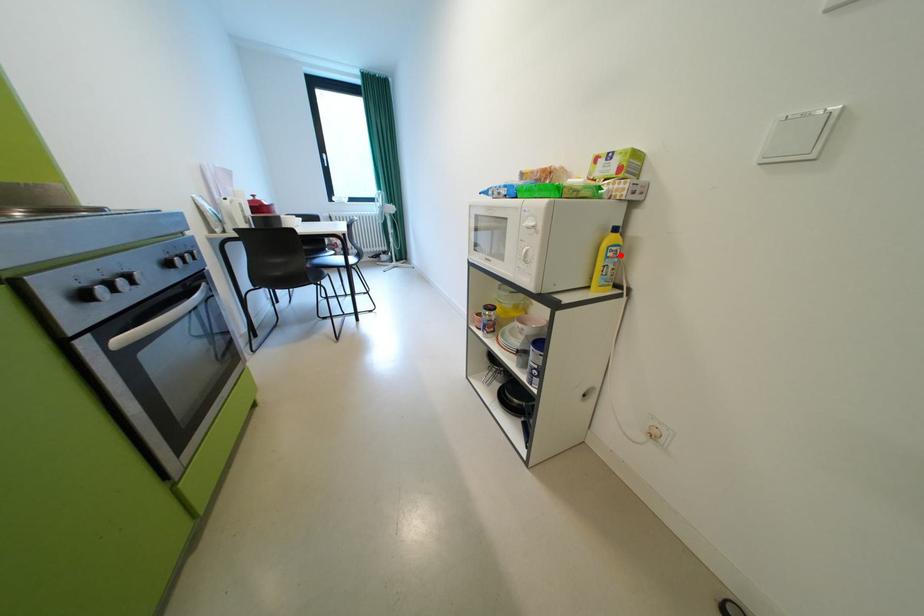
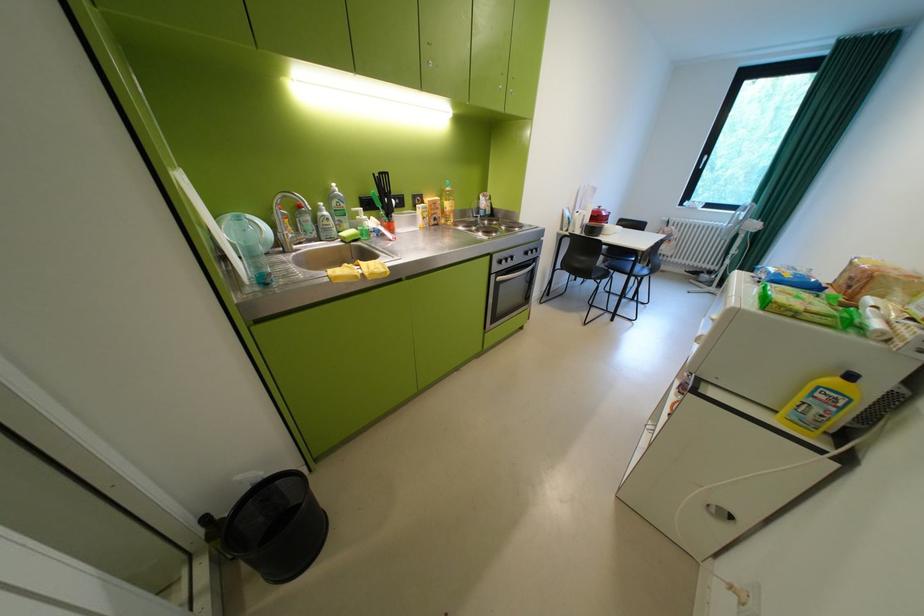
Question: I am providing you with two images of the same scene from different viewpoints. A red point is shown in image1. For the corresponding object point in image2, is it positioned nearer or farther from the camera?

Choices:
 (A) Nearer
 (B) Farther

Answer: (B)